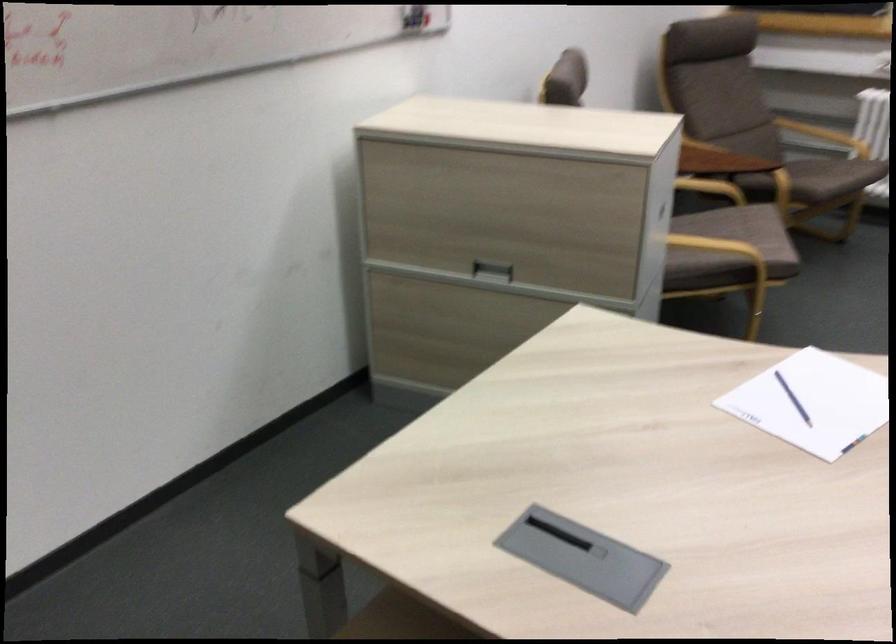
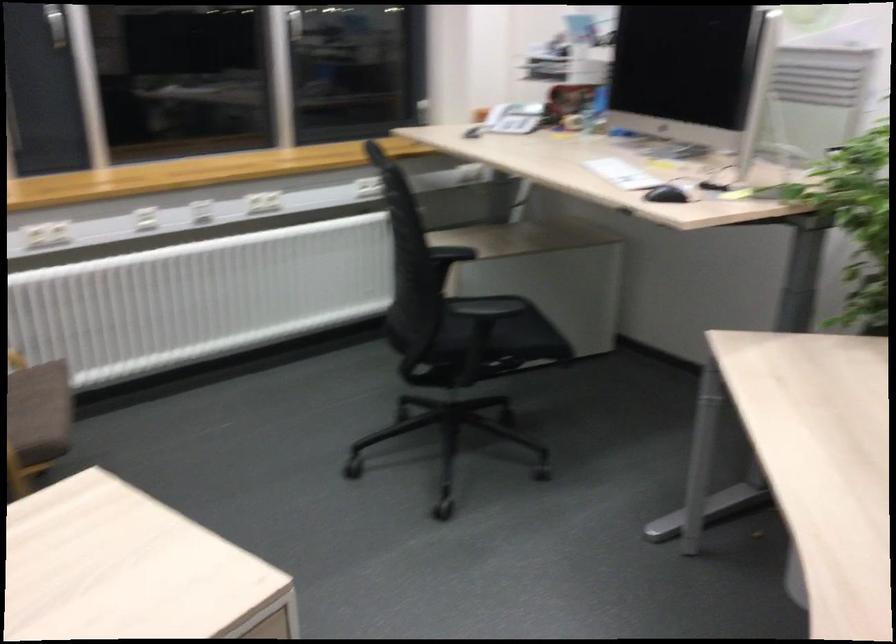
Question: I am providing you with two images of the same scene from different viewpoints. Please identify which objects are invisible in image2.

Choices:
 (A) purple mesh sponge
 (B) chair sitting surface
 (C) black chair sitting surface
 (D) black computer mouse

Answer: (B)